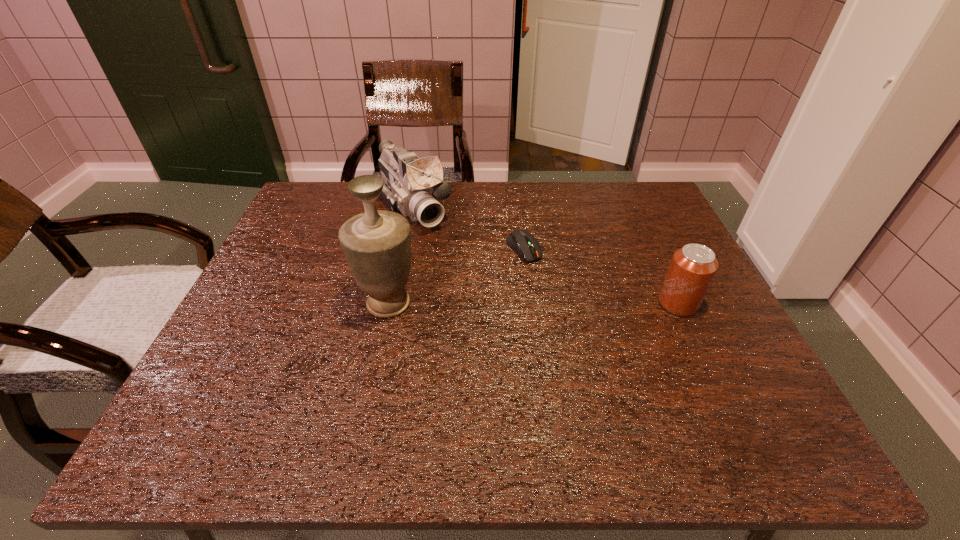
Locate an element on the screen. This screenshot has height=540, width=960. vacant area situated on the front-facing side of the camcorder is located at coordinates (454, 260).

At what (x,y) coordinates should I click in order to perform the action: click on vacant space situated 0.390m on the button of the second object from right to left. Please return your answer as a coordinate pair (x, y). Image resolution: width=960 pixels, height=540 pixels. Looking at the image, I should click on (625, 379).

This screenshot has width=960, height=540. Find the location of `vacant space located 0.220m on the button of the second object from right to left`. vacant space located 0.220m on the button of the second object from right to left is located at coordinates (578, 321).

Identify the location of vacant space located on the button of the second object from right to left. This screenshot has width=960, height=540. (586, 330).

The height and width of the screenshot is (540, 960). In order to click on object positioned at the far edge in this screenshot , I will do `click(413, 186)`.

Identify the location of object at the right edge. This screenshot has height=540, width=960. (693, 267).

In the image, there is a desktop. At what (x,y) coordinates should I click in order to perform the action: click on vacant space at the far edge. Please return your answer as a coordinate pair (x, y). Looking at the image, I should click on (476, 224).

I want to click on free region at the near edge, so click(598, 387).

Locate an element on the screen. vacant point at the left edge is located at coordinates (280, 235).

Image resolution: width=960 pixels, height=540 pixels. I want to click on free region at the right edge of the desktop, so click(645, 238).